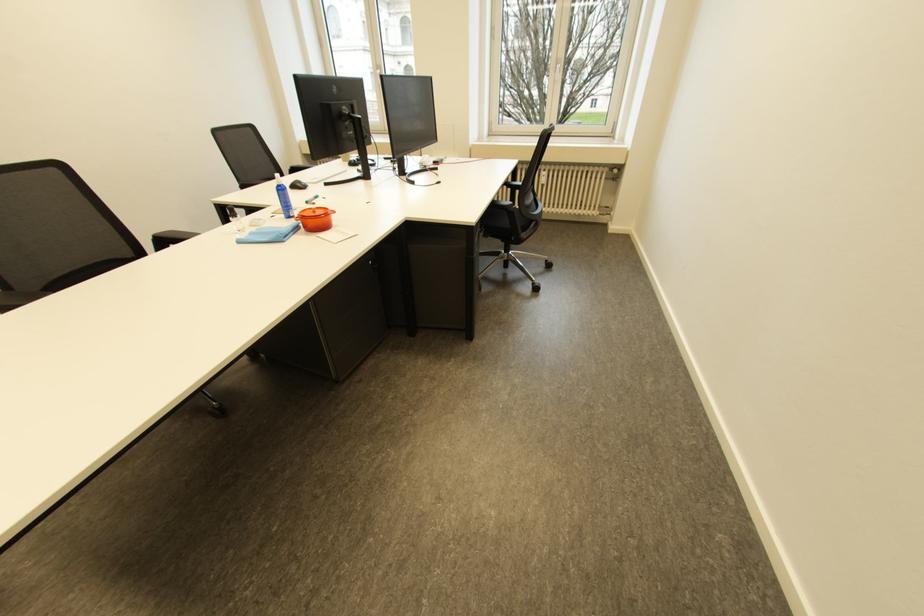
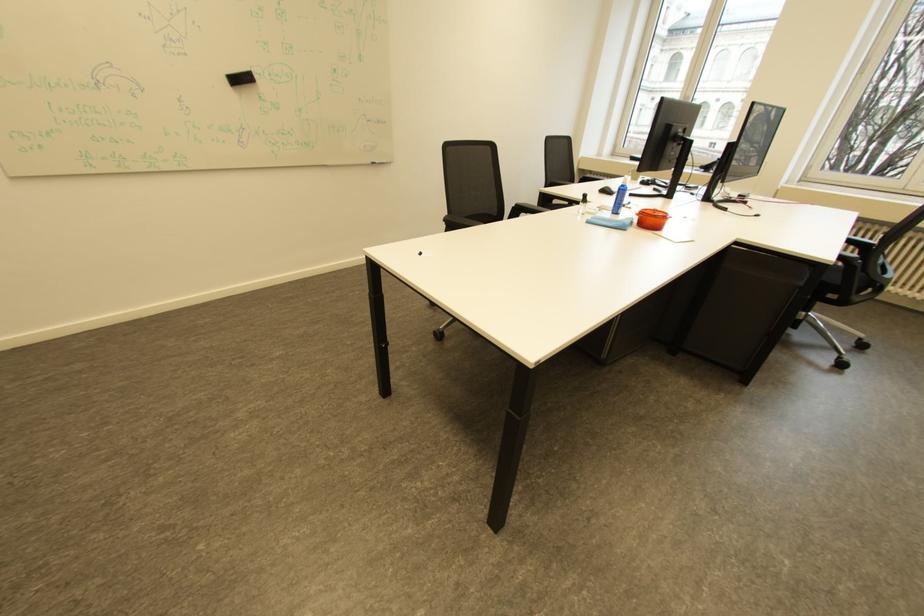
Question: The camera is either moving clockwise (left) or counter-clockwise (right) around the object. The first image is from the beginning of the video and the second image is from the end. Is the camera moving left or right when shooting the video?

Choices:
 (A) Left
 (B) Right

Answer: (B)